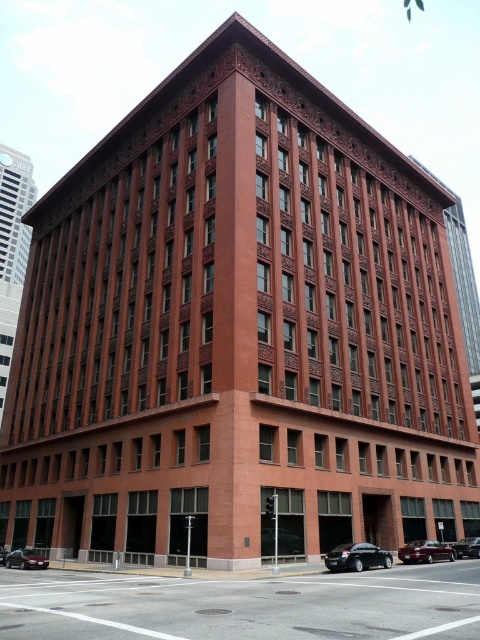
You are standing in front of the corner building and notice two points marked on the facade. The first point is located at coordinates point (360, 545) and the second at point (445, 550). Which point is nearer to your current position?

Point (360, 545) is closer to the camera than point (445, 550), so the first point is nearer to your current position.

You are a pedestrian standing at the corner of the building and want to cross the street to reach the entrance. There are two cars in your path. Which car, the shiny black sedan at lower center or the shiny maroon sedan at lower right, is closer to you?

The shiny black sedan at lower center is closer to you because it is positioned over the shiny maroon sedan at lower right, meaning it is in front of it from your perspective.

You are a delivery person trying to park your van in the parking lot behind the shiny black sedan at lower center and the shiny black sedan at center. Based on the space available, which of the two sedans do you think will allow you to park your van more easily?

The shiny black sedan at lower center might be wider than the shiny black sedan at center, so parking your van might be easier near the narrower shiny black sedan at center since it occupies less space.